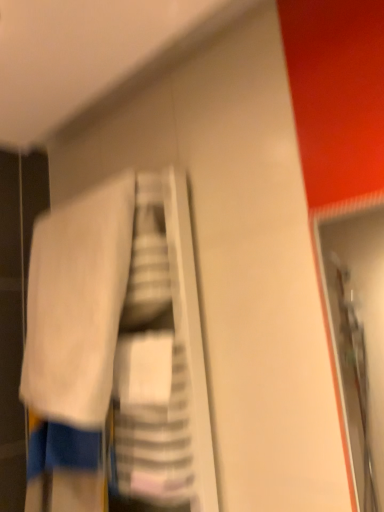
In order to face white fabric at center, should I rotate leftwards or rightwards?

You should look left and rotate roughly 12.995 degrees.

What is the approximate height of white fabric at center?

82.32 centimeters.

Identify the location of white fabric at center. The image size is (384, 512). (108, 353).

What do you see at coordinates (108, 353) in the screenshot? Image resolution: width=384 pixels, height=512 pixels. I see `white fabric at center` at bounding box center [108, 353].

In order to face white soft towel at upper left, should I rotate leftwards or rightwards?

It's best to rotate left around 15.957 degrees.

Describe the element at coordinates (77, 304) in the screenshot. I see `white soft towel at upper left` at that location.

This screenshot has width=384, height=512. I want to click on white soft towel at upper left, so click(x=77, y=304).

Find the location of `white fabric at center`. white fabric at center is located at coordinates click(108, 353).

Can you confirm if white fabric at center is positioned to the left of white soft towel at upper left?

No, white fabric at center is not to the left of white soft towel at upper left.

Consider the image. Which object is further away from the camera, white fabric at center or white soft towel at upper left?

white soft towel at upper left is further from the camera.

Considering the positions of points (135, 453) and (42, 289), is point (135, 453) farther from camera compared to point (42, 289)?

No, it is in front of (42, 289).

From the image's perspective, between white fabric at center and white soft towel at upper left, who is located below?

white fabric at center appears lower in the image.

From a real-world perspective, is white fabric at center located beneath white soft towel at upper left?

Yes, from a real-world perspective, white fabric at center is below white soft towel at upper left.

Considering the sizes of objects white fabric at center and white soft towel at upper left in the image provided, who is thinner, white fabric at center or white soft towel at upper left?

With smaller width is white soft towel at upper left.

Can you confirm if white fabric at center is taller than white soft towel at upper left?

Yes.

Considering the relative sizes of white fabric at center and white soft towel at upper left in the image provided, is white fabric at center bigger than white soft towel at upper left?

Correct, white fabric at center is larger in size than white soft towel at upper left.

Is white soft towel at upper left a part of white fabric at center?

Indeed, white soft towel at upper left is located within white fabric at center.

Is the surface of white fabric at center in direct contact with white soft towel at upper left?

Absolutely, white fabric at center is next to and touching white soft towel at upper left.

Is white fabric at center turned away from white soft towel at upper left?

Yes.

How different are the orientations of white fabric at center and white soft towel at upper left in degrees?

The angular difference between white fabric at center and white soft towel at upper left is 0.000131 degrees.

Locate an element on the screen. Image resolution: width=384 pixels, height=512 pixels. towel that appears behind the white fabric at center is located at coordinates (77, 304).

Is white soft towel at upper left to the left of white fabric at center from the viewer's perspective?

Yes, white soft towel at upper left is to the left of white fabric at center.

Looking at this image, in the image, is white soft towel at upper left positioned in front of or behind white fabric at center?

white soft towel at upper left is positioned farther from the viewer than white fabric at center.

Considering the points (111, 229) and (48, 325), which point is behind, point (111, 229) or point (48, 325)?

The point (48, 325) is farther.

Looking at this image, from the image's perspective, is white soft towel at upper left under white fabric at center?

Incorrect, from the image's perspective, white soft towel at upper left is higher than white fabric at center.

From a real-world perspective, does white soft towel at upper left stand above white fabric at center?

Yes, from a real-world perspective, white soft towel at upper left is over white fabric at center

Can you confirm if white soft towel at upper left is wider than white fabric at center?

No.

Is white soft towel at upper left shorter than white fabric at center?

Yes, white soft towel at upper left is shorter than white fabric at center.

Can you confirm if white soft towel at upper left is smaller than white fabric at center?

Correct, white soft towel at upper left occupies less space than white fabric at center.

Choose the correct answer: Is white soft towel at upper left inside white fabric at center or outside it?

white soft towel at upper left is inside white fabric at center.

Are white soft towel at upper left and white fabric at center located far from each other?

No, there isn't a large distance between white soft towel at upper left and white fabric at center.

From the picture: Could you tell me if white soft towel at upper left is facing white fabric at center?

No, white soft towel at upper left does not turn towards white fabric at center.

What's the angular difference between white soft towel at upper left and white fabric at center's facing directions?

white soft towel at upper left and white fabric at center are facing 0.000131 degrees away from each other.

Where is `towel on the left of white fabric at center`? This screenshot has width=384, height=512. towel on the left of white fabric at center is located at coordinates (77, 304).

The width and height of the screenshot is (384, 512). Identify the location of towel to the left of white fabric at center. (77, 304).

Identify the location of towel located above the white fabric at center (from the image's perspective). The image size is (384, 512). (77, 304).